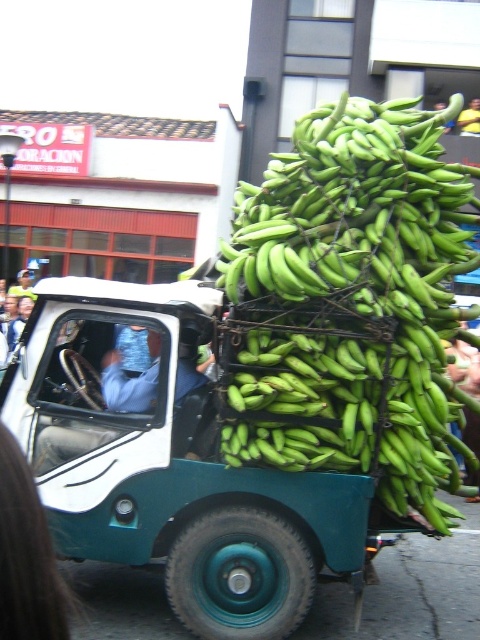
Question: Which of these objects is positioned farthest from the blue fabric shirt at left?

Choices:
 (A) green rubber truck at center
 (B) green matte bananas at center

Answer: (B)

Question: Which point is farther from the camera taking this photo?

Choices:
 (A) (110, 355)
 (B) (244, 618)
 (C) (398, 172)

Answer: (A)

Question: Is green rubber truck at center behind green matte bananas at center?

Choices:
 (A) yes
 (B) no

Answer: (A)

Question: Does green matte bananas at center have a greater width compared to blue fabric shirt at left?

Choices:
 (A) yes
 (B) no

Answer: (A)

Question: Is green matte bananas at center below blue fabric shirt at left?

Choices:
 (A) yes
 (B) no

Answer: (B)

Question: Based on their relative distances, which object is nearer to the blue fabric shirt at left?

Choices:
 (A) green rubber truck at center
 (B) green matte bananas at center

Answer: (A)